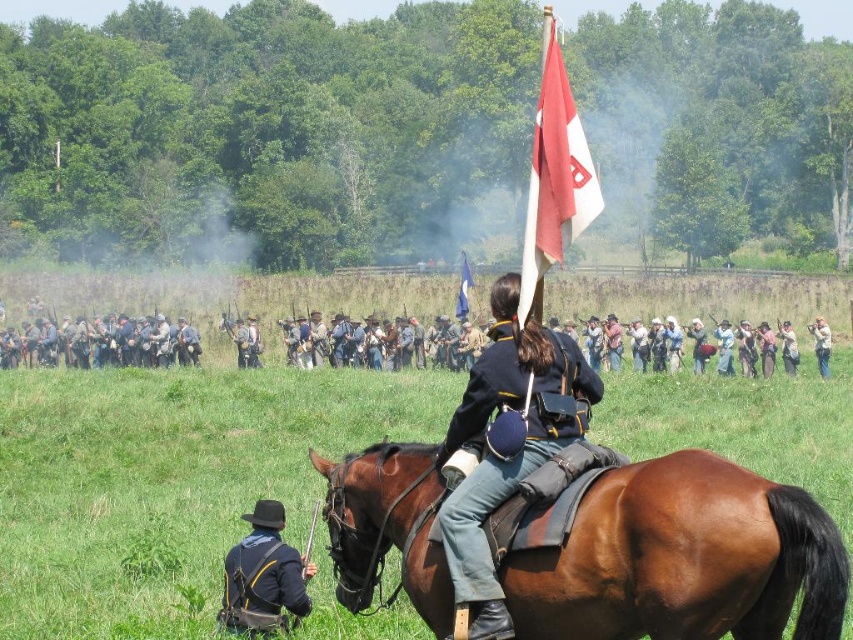
Can you confirm if red/white fabric flag at upper center is thinner than blue fabric flag at center?

No.

This screenshot has height=640, width=853. I want to click on red/white fabric flag at upper center, so pos(554,177).

The width and height of the screenshot is (853, 640). What are the coordinates of `red/white fabric flag at upper center` in the screenshot? It's located at (554, 177).

Between point (270, 445) and point (303, 611), which one is positioned behind?

Positioned behind is point (270, 445).

Is green grass at center to the right of black matte uniform at lower left from the viewer's perspective?

Indeed, green grass at center is positioned on the right side of black matte uniform at lower left.

Measure the distance between point (10, 541) and camera.

Point (10, 541) and camera are 59.47 feet apart from each other.

Where is `green grass at center`? This screenshot has width=853, height=640. green grass at center is located at coordinates (170, 481).

Between brown leather saddle at center and blue cotton uniform at center, which one appears on the left side from the viewer's perspective?

blue cotton uniform at center

Who is shorter, brown leather saddle at center or blue cotton uniform at center?

With less height is blue cotton uniform at center.

Is point (813, 547) behind point (462, 532)?

No, it is not.

The width and height of the screenshot is (853, 640). Find the location of `brown leather saddle at center`. brown leather saddle at center is located at coordinates (682, 557).